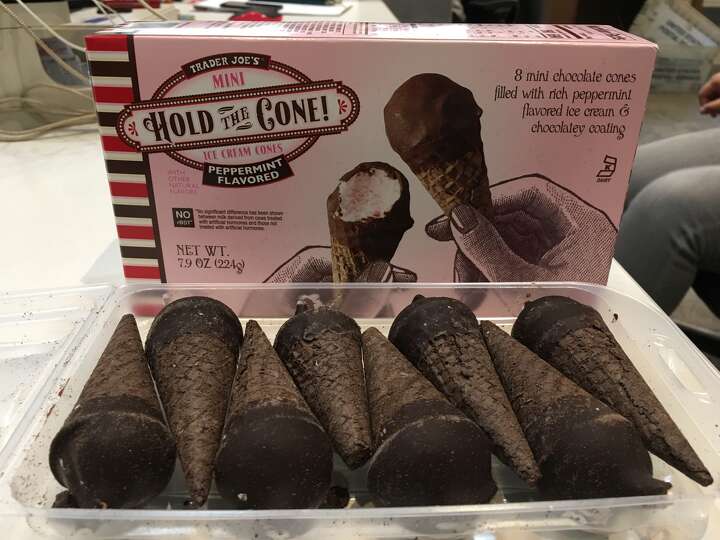
You are a GUI agent. You are given a task and a screenshot of the screen. Output one action in this format:
    pyautogui.click(x=<x>, y=<y>)
    Task: Click on the boxes
    This screenshot has height=540, width=720.
    Given the screenshot: What is the action you would take?
    pyautogui.click(x=288, y=198)